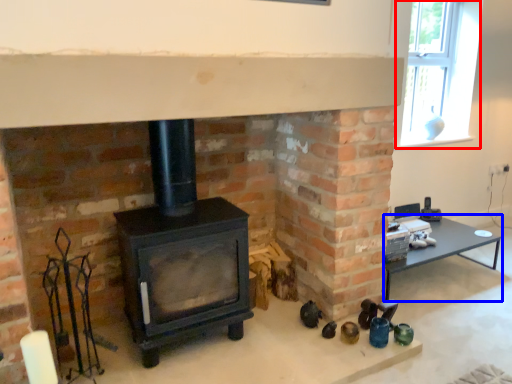
Question: Which object is further to the camera taking this photo, window (highlighted by a red box) or table (highlighted by a blue box)?

Choices:
 (A) window
 (B) table

Answer: (A)